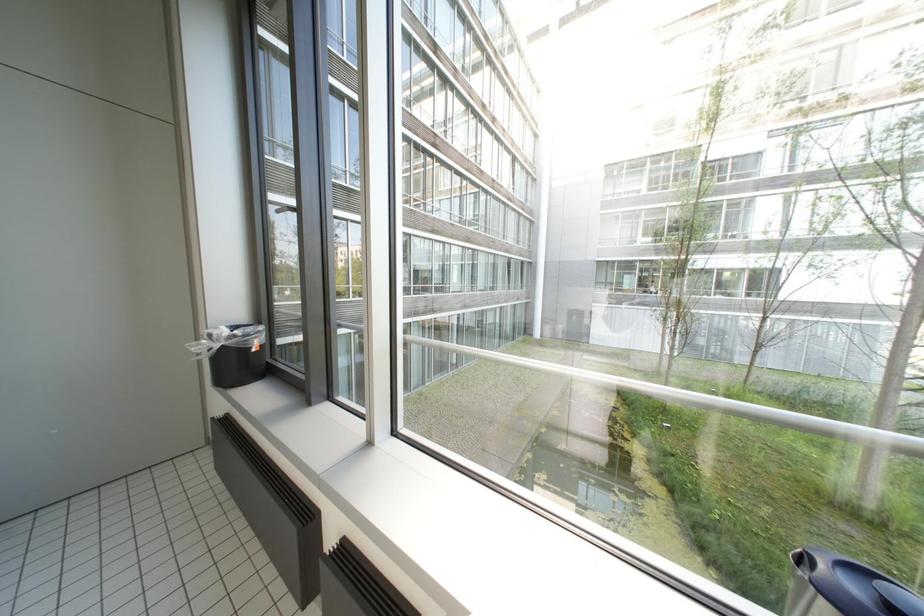
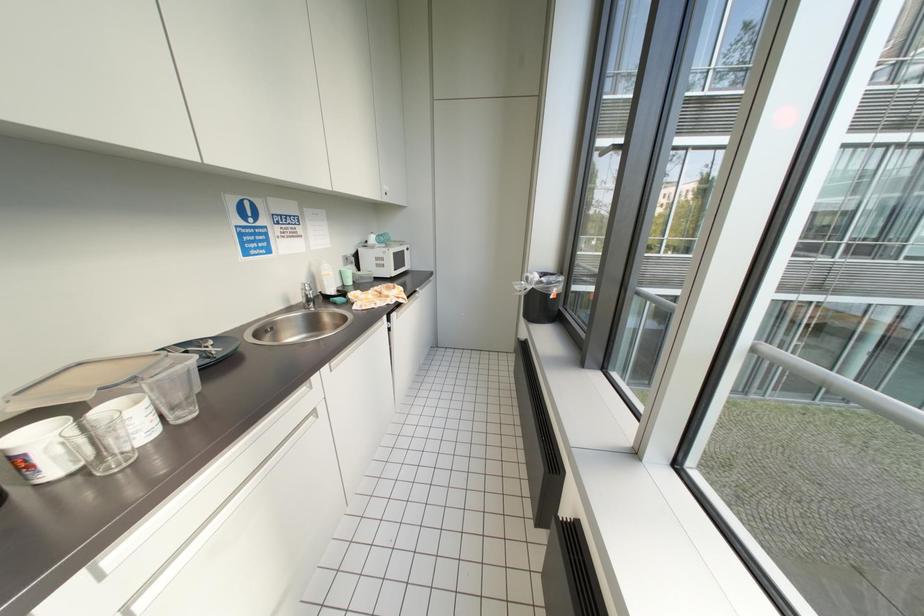
Question: The images are taken continuously from a first-person perspective. In which direction is your viewpoint rotating?

Choices:
 (A) Left
 (B) Right
 (C) Up
 (D) Down

Answer: (A)